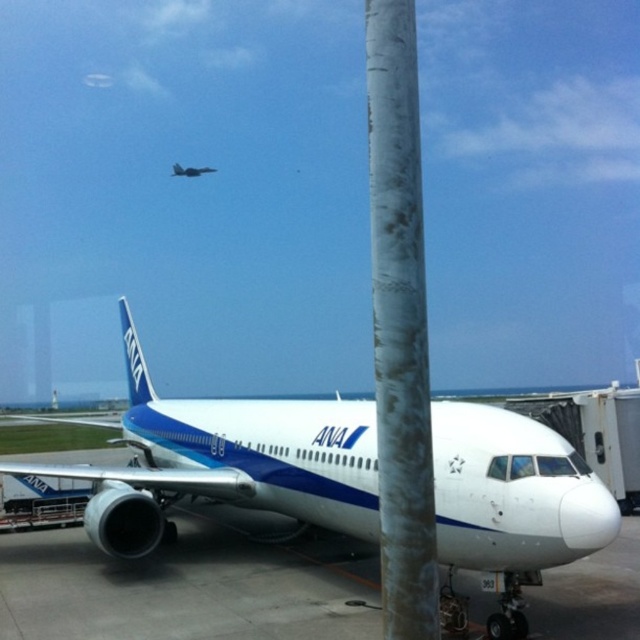
Question: Which object is farther from the camera taking this photo?

Choices:
 (A) gray textured pole at center
 (B) white glossy airplane at center
 (C) metallic blue airplane at center

Answer: (C)

Question: Is the position of white glossy airplane at center less distant than that of gray textured pole at center?

Choices:
 (A) no
 (B) yes

Answer: (B)

Question: Which of the following is the farthest from the observer?

Choices:
 (A) (209, 172)
 (B) (515, 579)
 (C) (412, 77)

Answer: (A)

Question: Is white glossy airplane at center above metallic blue airplane at center?

Choices:
 (A) yes
 (B) no

Answer: (B)

Question: Which object is farther from the camera taking this photo?

Choices:
 (A) white glossy airplane at center
 (B) gray textured pole at center
 (C) metallic blue airplane at center

Answer: (C)

Question: Is the position of gray textured pole at center more distant than that of metallic blue airplane at center?

Choices:
 (A) yes
 (B) no

Answer: (B)